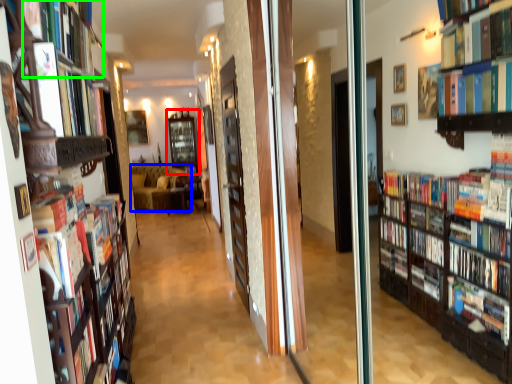
Question: Based on their relative distances, which object is farther from shelf (highlighted by a red box)? Choose from couch (highlighted by a blue box) and book (highlighted by a green box).

Choices:
 (A) couch
 (B) book

Answer: (B)